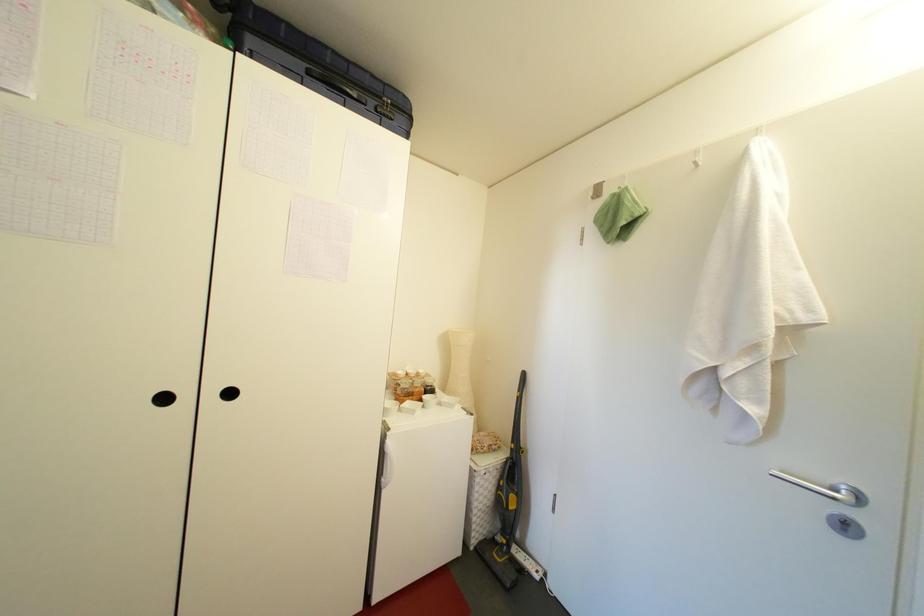
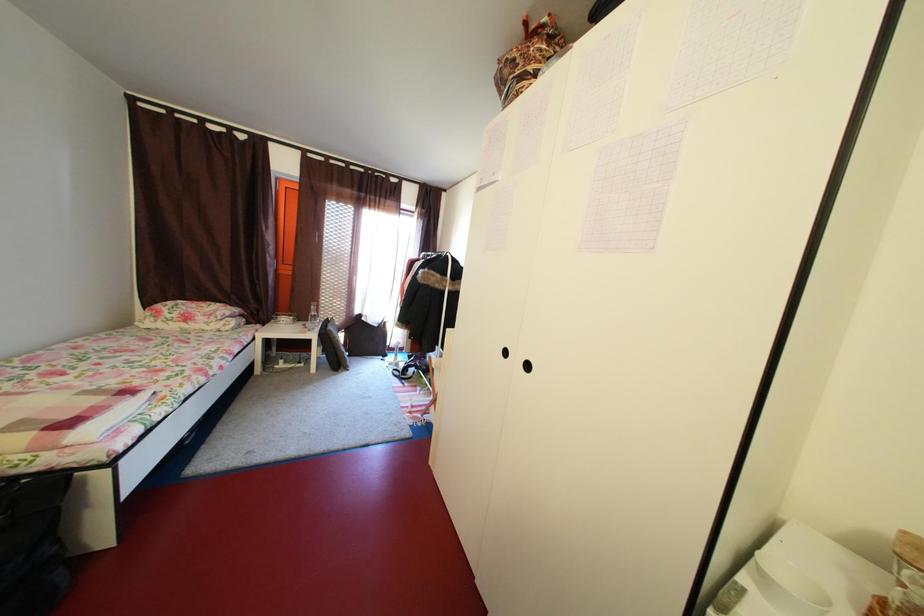
Question: How did the camera likely rotate?

Choices:
 (A) Left
 (B) Right
 (C) Up
 (D) Down

Answer: (A)